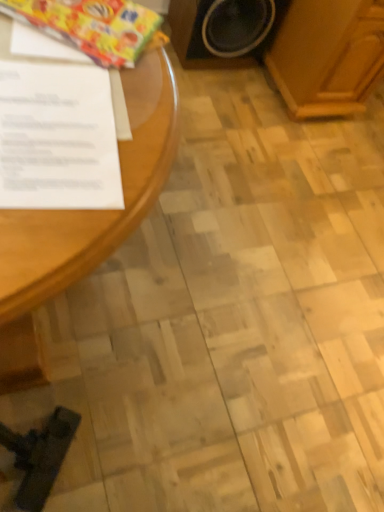
Question: Is white paper at left smaller than shiny plastic wrapping paper at upper left?

Choices:
 (A) yes
 (B) no

Answer: (A)

Question: Can you confirm if white paper at left is bigger than shiny plastic wrapping paper at upper left?

Choices:
 (A) yes
 (B) no

Answer: (B)

Question: From the image's perspective, is white paper at left on shiny plastic wrapping paper at upper left?

Choices:
 (A) no
 (B) yes

Answer: (A)

Question: Is shiny plastic wrapping paper at upper left inside white paper at left?

Choices:
 (A) no
 (B) yes

Answer: (A)

Question: From a real-world perspective, does white paper at left stand above shiny plastic wrapping paper at upper left?

Choices:
 (A) no
 (B) yes

Answer: (B)

Question: Considering the positions of shiny plastic wrapping paper at upper left and white paper at left in the image, is shiny plastic wrapping paper at upper left bigger or smaller than white paper at left?

Choices:
 (A) big
 (B) small

Answer: (A)

Question: From a real-world perspective, is shiny plastic wrapping paper at upper left above or below white paper at left?

Choices:
 (A) below
 (B) above

Answer: (A)

Question: From the image's perspective, is shiny plastic wrapping paper at upper left positioned above or below white paper at left?

Choices:
 (A) above
 (B) below

Answer: (A)

Question: Considering their positions, is shiny plastic wrapping paper at upper left located in front of or behind white paper at left?

Choices:
 (A) behind
 (B) front

Answer: (A)

Question: In terms of height, does white paper at left look taller or shorter compared to wooden speaker at upper right?

Choices:
 (A) tall
 (B) short

Answer: (B)

Question: Considering their positions, is white paper at left located in front of or behind wooden speaker at upper right?

Choices:
 (A) front
 (B) behind

Answer: (A)

Question: Is white paper at left wider or thinner than wooden speaker at upper right?

Choices:
 (A) thin
 (B) wide

Answer: (A)

Question: From the image's perspective, is white paper at left positioned above or below wooden speaker at upper right?

Choices:
 (A) above
 (B) below

Answer: (B)

Question: Is white paper at left bigger or smaller than shiny plastic wrapping paper at upper left?

Choices:
 (A) small
 (B) big

Answer: (A)

Question: In terms of width, does white paper at left look wider or thinner when compared to shiny plastic wrapping paper at upper left?

Choices:
 (A) thin
 (B) wide

Answer: (A)